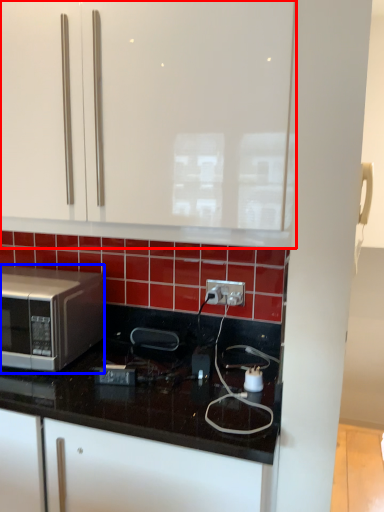
Question: Which object appears closest to the camera in this image, cabinetry (highlighted by a red box) or microwave oven (highlighted by a blue box)?

Choices:
 (A) cabinetry
 (B) microwave oven

Answer: (A)